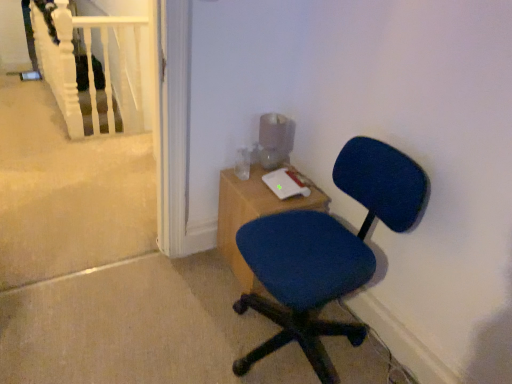
In order to click on free spot to the left of wooden desk at center in this screenshot , I will do `click(189, 272)`.